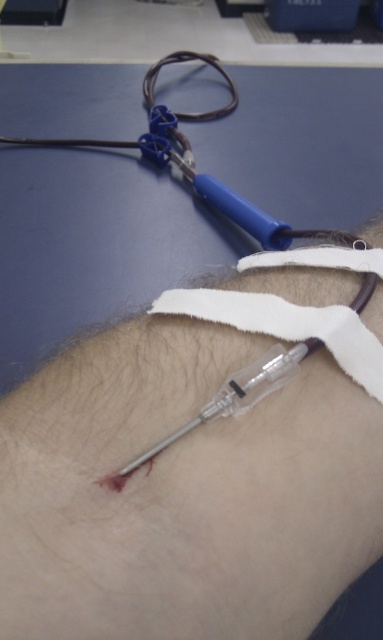
Question: Is white fabric strap at lower center thinner than transparent plastic syringe at lower center?

Choices:
 (A) no
 (B) yes

Answer: (A)

Question: Does clear plastic needle at center appear on the left side of white fabric strap at lower center?

Choices:
 (A) yes
 (B) no

Answer: (B)

Question: Based on their relative distances, which object is farther from the clear plastic needle at center?

Choices:
 (A) white fabric strap at lower center
 (B) transparent plastic syringe at lower center

Answer: (B)

Question: Which object is the farthest from the transparent plastic syringe at lower center?

Choices:
 (A) clear plastic needle at center
 (B) white fabric strap at lower center

Answer: (A)

Question: Which of these objects is positioned farthest from the clear plastic needle at center?

Choices:
 (A) transparent plastic syringe at lower center
 (B) white fabric strap at lower center

Answer: (A)

Question: Does clear plastic needle at center have a lesser width compared to transparent plastic syringe at lower center?

Choices:
 (A) yes
 (B) no

Answer: (B)